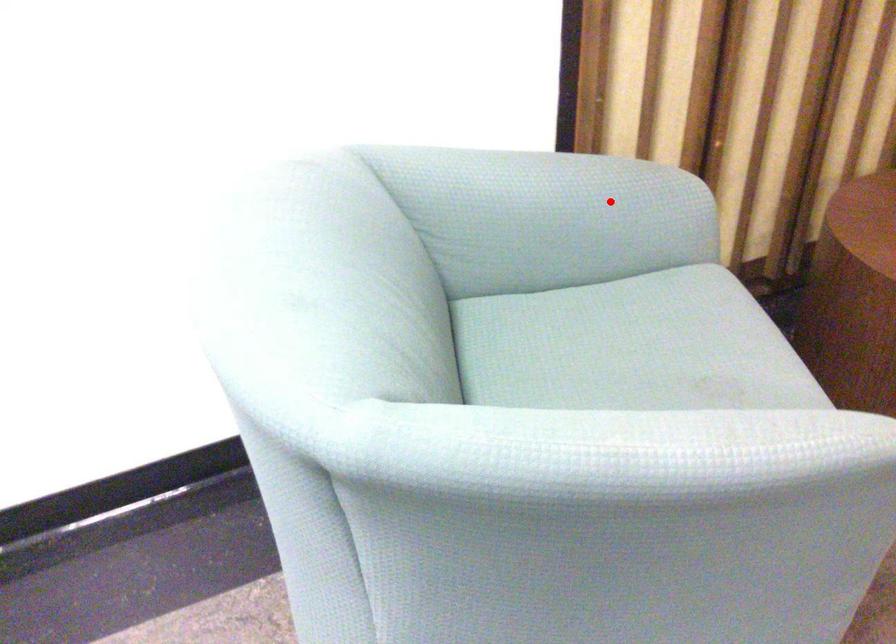
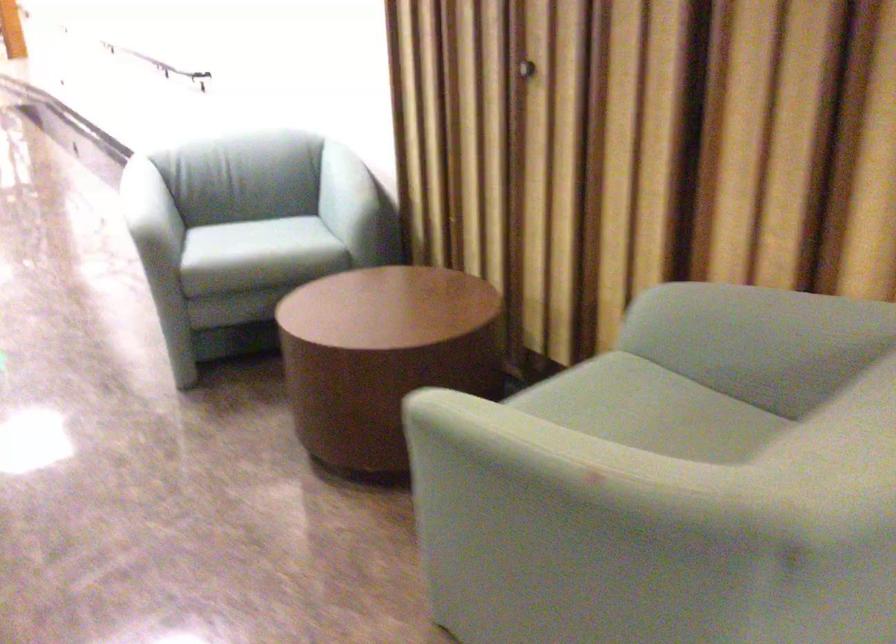
Question: I am providing you with two images of the same scene from different viewpoints. Image1 has a red point marked. In image2, the corresponding 3D location appears at what relative position? Reply with the corresponding letter.

Choices:
 (A) Closer
 (B) Farther

Answer: (B)